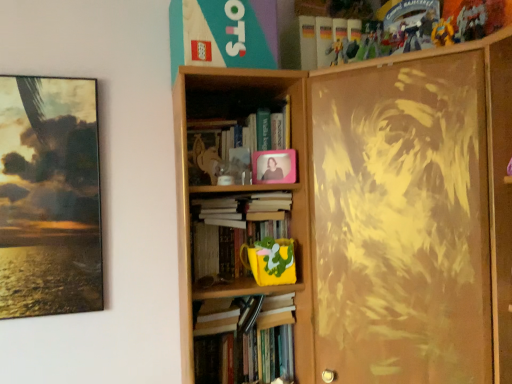
Question: From the image's perspective, is wooden bookcase at center, the 1th bookcase in the left-to-right sequence, positioned above or below yellow matte mug at center, the second book positioned from the bottom?

Choices:
 (A) above
 (B) below

Answer: (A)

Question: From a real-world perspective, is wooden bookcase at center, the 1th bookcase in the left-to-right sequence, physically located above or below yellow matte mug at center, the second book from the top?

Choices:
 (A) below
 (B) above

Answer: (B)

Question: Based on their relative distances, which object is nearer to the wooden bookcase at center, which is the 2th bookcase in right-to-left order?

Choices:
 (A) matte plastic picture frame at upper center
 (B) hardcover book at center, which appears as the 1th book when ordered from the bottom
 (C) yellow matte action figure at upper right
 (D) yellow matte mug at center, the second book from the top
 (E) pink matte photo frame at upper center, which appears as the first book when viewed from the top

Answer: (D)

Question: Based on their relative distances, which object is farther from the matte plastic picture frame at upper center?

Choices:
 (A) yellow matte action figure at upper right
 (B) pink matte photo frame at upper center, which appears as the first book when viewed from the top
 (C) hardcover book at center, the 3th book from the top
 (D) matte brown painting at right, the 1th bookcase viewed from the right
 (E) matte paper book at upper center

Answer: (A)